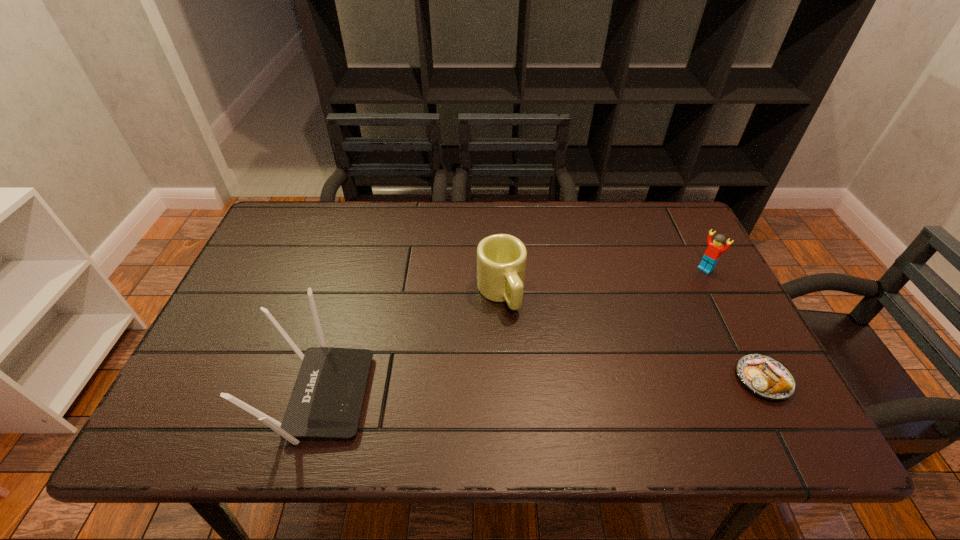
You are a GUI agent. You are given a task and a screenshot of the screen. Output one action in this format:
    pyautogui.click(x=<x>, y=<y>)
    Task: Click on the tallest object
    
    Given the screenshot: What is the action you would take?
    pyautogui.click(x=326, y=402)

I want to click on the leftmost object, so click(x=326, y=402).

The image size is (960, 540). What are the coordinates of `pastry` in the screenshot? It's located at (765, 376).

You are a GUI agent. You are given a task and a screenshot of the screen. Output one action in this format:
    pyautogui.click(x=<x>, y=<y>)
    Task: Click on the Lego
    This screenshot has height=540, width=960.
    Given the screenshot: What is the action you would take?
    point(715,248)

In order to click on mug in this screenshot , I will do `click(501, 258)`.

This screenshot has height=540, width=960. I want to click on vacant space situated 0.070m on the front-facing side of the tallest object, so click(x=398, y=395).

The image size is (960, 540). I want to click on free space located on the left of the shortest object, so click(713, 379).

You are a GUI agent. You are given a task and a screenshot of the screen. Output one action in this format:
    pyautogui.click(x=<x>, y=<y>)
    Task: Click on the blank space located on the face of the Lego
    
    Given the screenshot: What is the action you would take?
    pyautogui.click(x=673, y=296)

Locate an element on the screen. Image resolution: width=960 pixels, height=540 pixels. vacant space situated 0.350m on the face of the Lego is located at coordinates (625, 337).

Where is `free space located 0.150m on the face of the Lego`? This screenshot has width=960, height=540. free space located 0.150m on the face of the Lego is located at coordinates (671, 299).